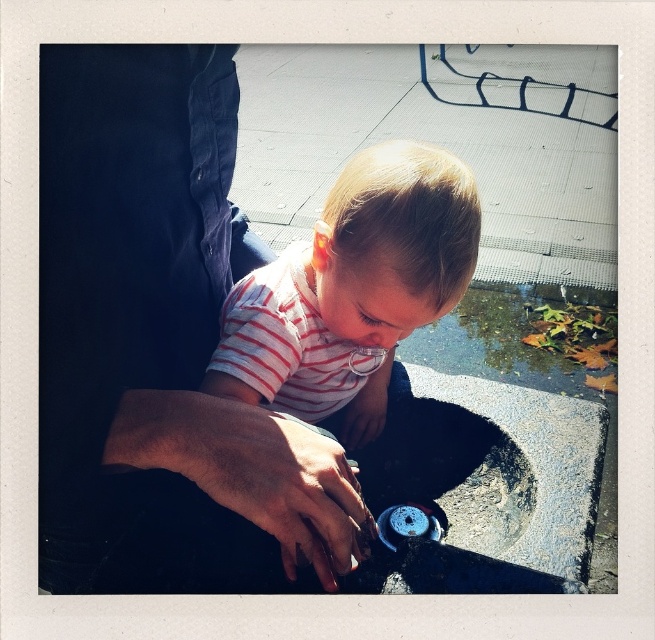
Which is in front, point (464, 216) or point (288, 480)?

Point (288, 480) is in front.

Where is `white striped shirt at center`? The height and width of the screenshot is (640, 655). white striped shirt at center is located at coordinates (350, 289).

Which is more to the right, dark blue jeans at left or dark skin/hair at center?

From the viewer's perspective, dark skin/hair at center appears more on the right side.

Does dark blue jeans at left have a larger size compared to dark skin/hair at center?

Yes.

At what (x,y) coordinates should I click in order to perform the action: click on dark blue jeans at left. Please return your answer as a coordinate pair (x, y). This screenshot has height=640, width=655. Looking at the image, I should click on (157, 340).

Find the location of `dark blue jeans at left`. dark blue jeans at left is located at coordinates (157, 340).

Which is in front, point (309, 541) or point (202, 387)?

Point (309, 541) is in front.

Is dark blue jeans at left above white striped shirt at center?

Actually, dark blue jeans at left is below white striped shirt at center.

Between point (105, 509) and point (364, 396), which one is positioned behind?

Positioned behind is point (364, 396).

Where is `dark blue jeans at left`? The image size is (655, 640). dark blue jeans at left is located at coordinates (157, 340).